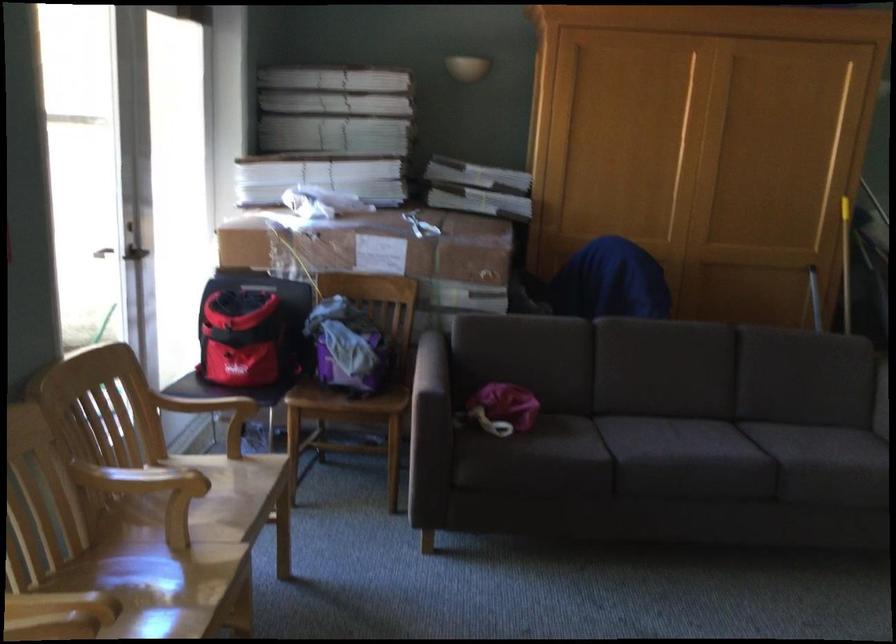
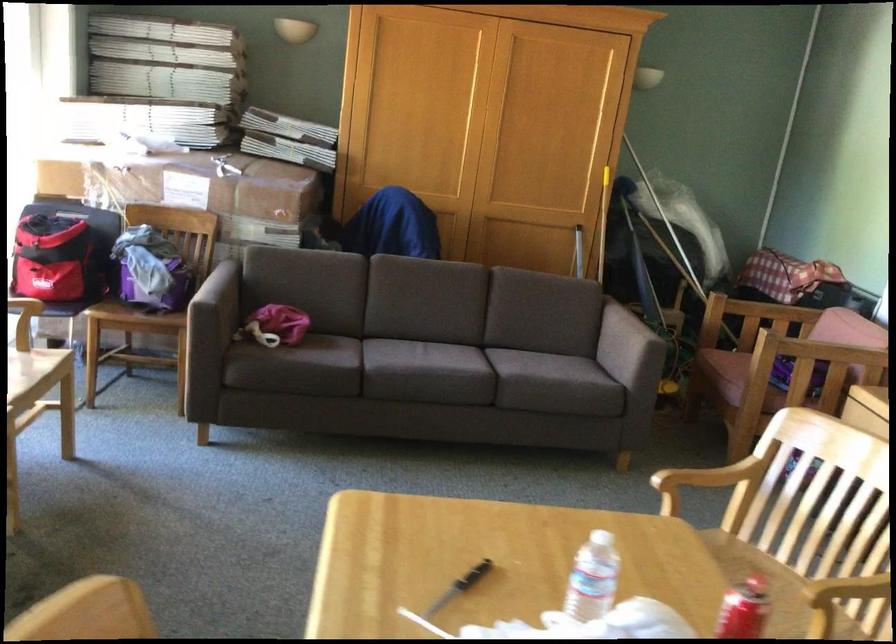
Question: The camera is either moving clockwise (left) or counter-clockwise (right) around the object. The first image is from the beginning of the video and the second image is from the end. Is the camera moving left or right when shooting the video?

Choices:
 (A) Left
 (B) Right

Answer: (A)